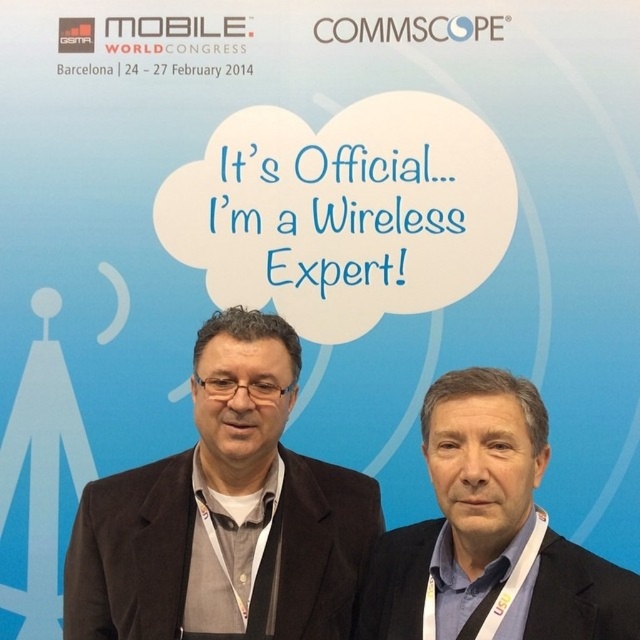
You are a fashion designer observing two suits displayed at the Mobile World Congress 2014 event. The suits are the matte black suit at center and the dark blue suit at center. Which one is placed to the left of the other?

The matte black suit at center is positioned on the left side of dark blue suit at center.

You are a photographer at the Mobile World Congress 2014 event. You need to position two models wearing the matte black suit at center and the dark blue suit at center for a group photo. The backdrop has a speech bubble graphic in the center. Which suit should the taller model wear to ensure they stand out in the photo?

The matte black suit at center is much taller than the dark blue suit at center, so the taller model should wear the matte black suit at center to stand out in the photo.

What is the spatial relationship between the matte black suit at center and the dark blue suit at center in the image?

The matte black suit at center is positioned below the dark blue suit at center.